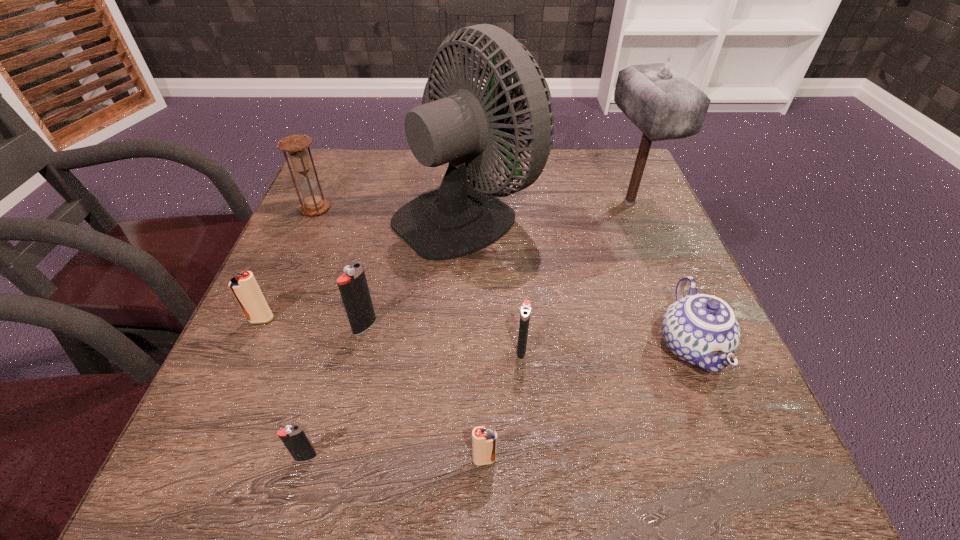
Locate an element on the screen. object present at the far right corner is located at coordinates (664, 105).

Locate an element on the screen. The image size is (960, 540). vacant area at the far edge of the desktop is located at coordinates (385, 165).

This screenshot has width=960, height=540. What are the coordinates of `vacant space at the near edge` in the screenshot? It's located at (573, 450).

Locate an element on the screen. Image resolution: width=960 pixels, height=540 pixels. vacant space at the left edge is located at coordinates (295, 288).

Image resolution: width=960 pixels, height=540 pixels. What are the coordinates of `vacant space at the right edge of the desktop` in the screenshot? It's located at 657,207.

Where is `vacant space at the far left corner of the desktop`? vacant space at the far left corner of the desktop is located at coordinates (354, 195).

Find the location of a particular element. free space at the far right corner of the desktop is located at coordinates (620, 168).

Where is `free spot at the near right corner of the desktop`? This screenshot has height=540, width=960. free spot at the near right corner of the desktop is located at coordinates (740, 492).

The image size is (960, 540). I want to click on free point between the hourglass and the bigger red igniter, so click(289, 264).

This screenshot has height=540, width=960. What are the coordinates of `free space between the rightmost igniter and the chinaware` in the screenshot? It's located at click(x=606, y=348).